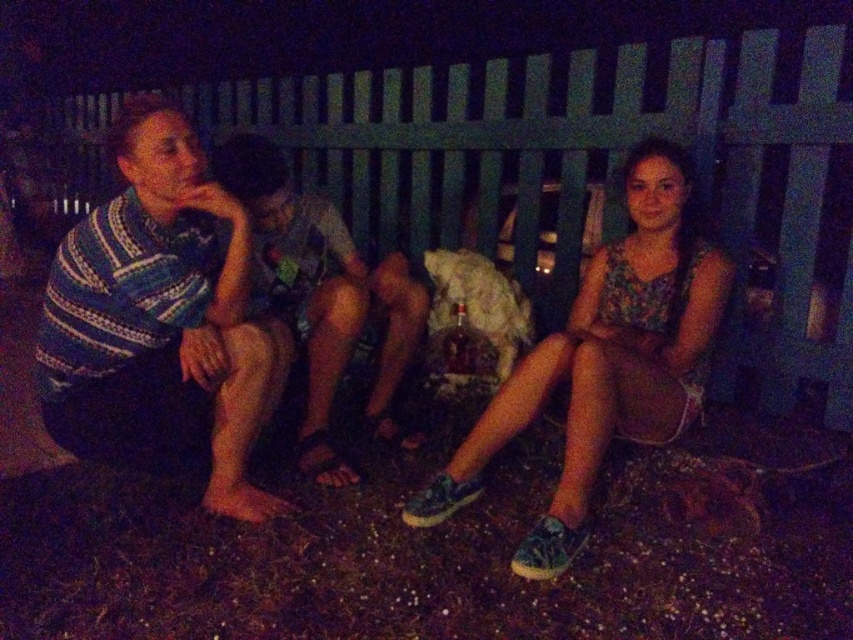
Question: Does striped knit shirt at left lie in front of striped knit shirt at center?

Choices:
 (A) yes
 (B) no

Answer: (A)

Question: Is green wooden fence at upper center behind striped knit shirt at center?

Choices:
 (A) no
 (B) yes

Answer: (A)

Question: Does green wooden fence at upper center appear over striped knit shirt at center?

Choices:
 (A) yes
 (B) no

Answer: (A)

Question: Considering the real-world distances, which object is closest to the striped knit shirt at center?

Choices:
 (A) striped knit shirt at left
 (B) floral fabric dress at center
 (C) green wooden fence at upper center

Answer: (A)

Question: Estimate the real-world distances between objects in this image. Which object is farther from the striped knit shirt at center?

Choices:
 (A) green wooden fence at upper center
 (B) striped knit shirt at left

Answer: (A)

Question: Which object is positioned farthest from the striped knit shirt at left?

Choices:
 (A) floral fabric dress at center
 (B) striped knit shirt at center
 (C) green wooden fence at upper center

Answer: (C)